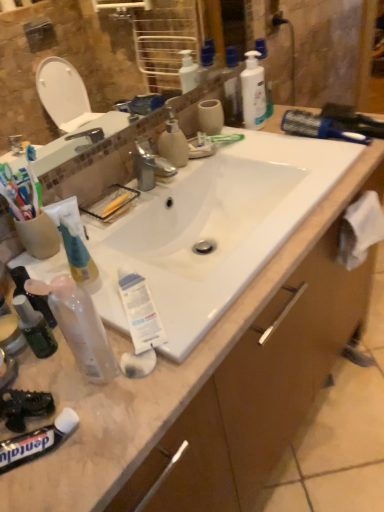
The image size is (384, 512). I want to click on vacant area that lies to the right of white matte tube at center, the 2th toothpaste positioned from the bottom, so click(239, 295).